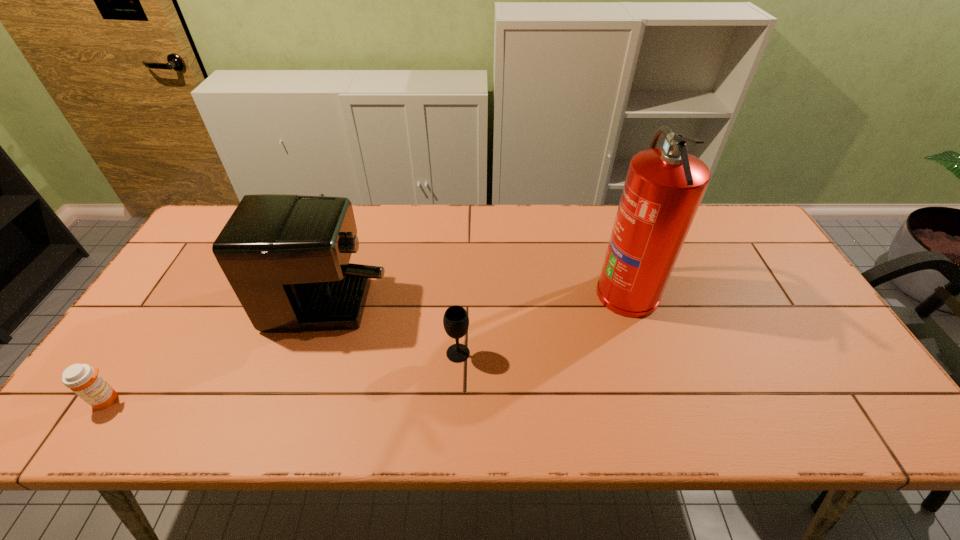
Where is `vacant point located between the wineglass and the third shortest object`? The width and height of the screenshot is (960, 540). vacant point located between the wineglass and the third shortest object is located at coordinates (392, 308).

The height and width of the screenshot is (540, 960). In order to click on unoccupied position between the second nearest object and the second tallest object in this screenshot , I will do `click(392, 308)`.

This screenshot has height=540, width=960. Find the location of `vacant space that's between the leftmost object and the fire extinguisher`. vacant space that's between the leftmost object and the fire extinguisher is located at coordinates (367, 346).

Identify the location of free spot between the medicine and the tallest object. (367, 346).

You are a GUI agent. You are given a task and a screenshot of the screen. Output one action in this format:
    pyautogui.click(x=<x>, y=<y>)
    Task: Click on the object that is the second closest to the third shortest object
    The image size is (960, 540).
    Given the screenshot: What is the action you would take?
    pyautogui.click(x=84, y=380)

The width and height of the screenshot is (960, 540). I want to click on the third closest object relative to the rightmost object, so (84, 380).

The image size is (960, 540). In order to click on free point that satisfies the following two spatial constraints: 1. on the front-facing side of the third shortest object; 2. on the left side of the third tallest object in this screenshot , I will do `click(293, 353)`.

Where is `vacant space that satisfies the following two spatial constraints: 1. on the instruction side of the tallest object; 2. on the front side of the third tallest object`? This screenshot has height=540, width=960. vacant space that satisfies the following two spatial constraints: 1. on the instruction side of the tallest object; 2. on the front side of the third tallest object is located at coordinates [646, 353].

This screenshot has width=960, height=540. I want to click on free space that satisfies the following two spatial constraints: 1. on the front-facing side of the third object from left to right; 2. on the right side of the third shortest object, so click(293, 353).